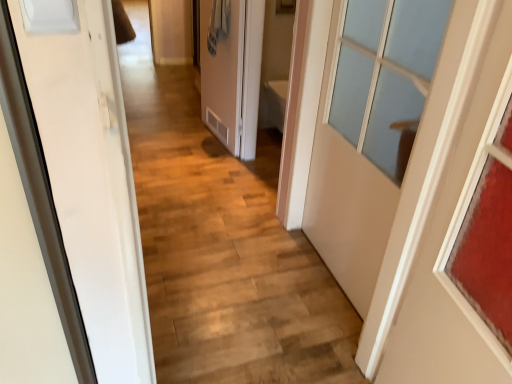
You are a GUI agent. You are given a task and a screenshot of the screen. Output one action in this format:
    pyautogui.click(x=<x>, y=<y>)
    Task: Click on the free space that is to the left of matte white door at center, the third door from the right
    The width and height of the screenshot is (512, 384).
    Given the screenshot: What is the action you would take?
    pyautogui.click(x=176, y=140)